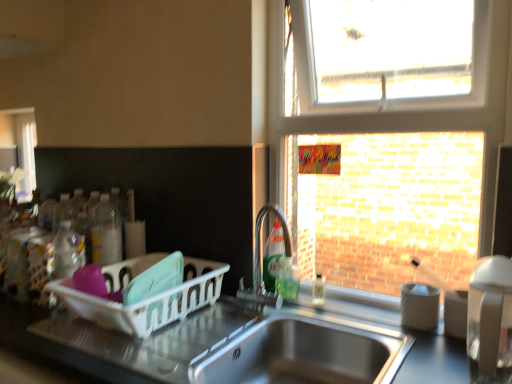
Question: From the image's perspective, is green translucent soap dispenser at sink, positioned as the 2th bottle in right-to-left order, positioned above or below stainless steel sink at lower center?

Choices:
 (A) above
 (B) below

Answer: (A)

Question: In terms of size, does green translucent soap dispenser at sink, positioned as the 2th bottle in right-to-left order, appear bigger or smaller than stainless steel sink at lower center?

Choices:
 (A) big
 (B) small

Answer: (B)

Question: Which object is positioned closest to the translucent plastic soap dispenser at sink right, which is counted as the 4th bottle, starting from the left?

Choices:
 (A) green matte dish soap at center, which is the third bottle from right to left
 (B) stainless steel sink at lower center
 (C) white plastic dish rack at left, the first appliance viewed from the left
 (D) metallic stainless steel sink at center
 (E) white glossy coffee maker at right, positioned as the 2th appliance in back-to-front order

Answer: (A)

Question: Estimate the real-world distances between objects in this image. Which object is closer to the white glossy coffee maker at right, acting as the 2th appliance starting from the left?

Choices:
 (A) metallic stainless steel sink at center
 (B) clear glass window at upper right
 (C) white plastic dish rack at left, the 2th appliance from the right
 (D) stainless steel sink at lower center
 (E) green translucent soap dispenser at sink, acting as the third bottle starting from the left

Answer: (D)